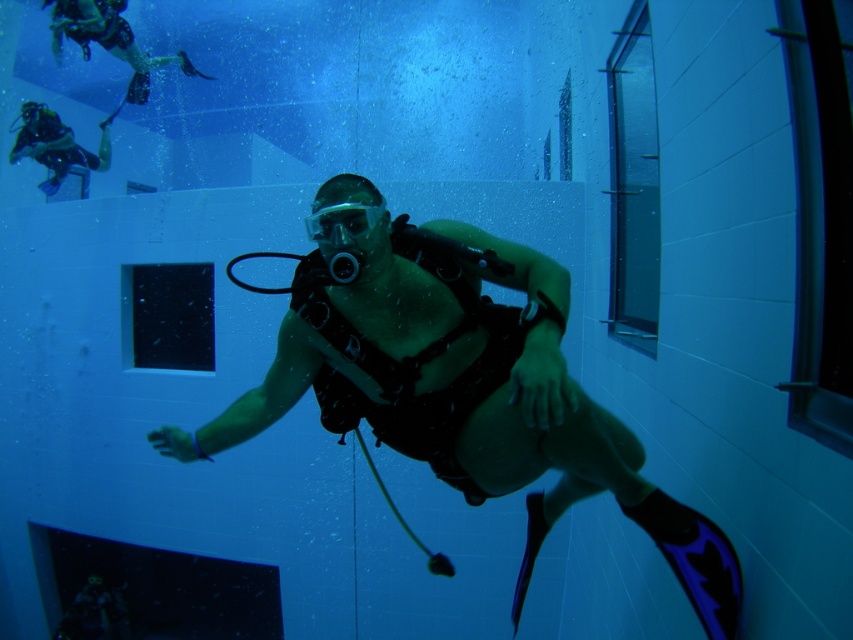
Question: Which of the following is the farthest from the observer?

Choices:
 (A) (381, 204)
 (B) (392, 348)

Answer: (B)

Question: Can you confirm if matte black scuba gear at center is positioned to the right of clear plastic goggles at center?

Choices:
 (A) yes
 (B) no

Answer: (A)

Question: Does matte black scuba gear at center have a smaller size compared to clear plastic goggles at center?

Choices:
 (A) no
 (B) yes

Answer: (A)

Question: Is matte black scuba gear at center wider than clear plastic goggles at center?

Choices:
 (A) yes
 (B) no

Answer: (A)